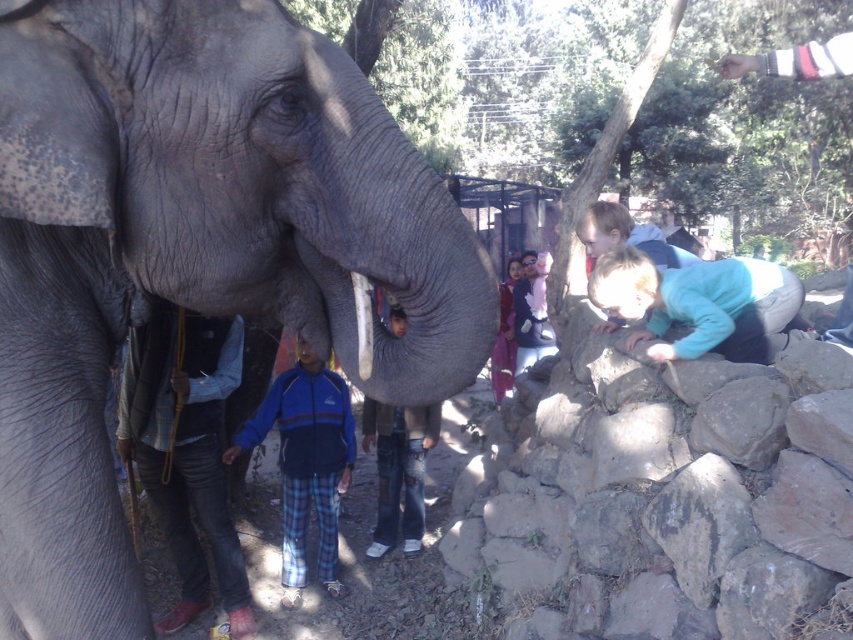
Measure the distance between light blue fleece at lower right and camera.

light blue fleece at lower right and camera are 2.97 meters apart from each other.

Locate an element on the screen. light blue fleece at lower right is located at coordinates (699, 304).

Image resolution: width=853 pixels, height=640 pixels. Identify the location of light blue fleece at lower right. (699, 304).

Is denim pants at left thinner than light blue fleece at lower right?

Yes, denim pants at left is thinner than light blue fleece at lower right.

Does denim pants at left have a lesser height compared to light blue fleece at lower right?

No.

Who is more distant from viewer, (175, 435) or (651, 355)?

Point (175, 435)

Locate an element on the screen. This screenshot has width=853, height=640. denim pants at left is located at coordinates (187, 452).

Who is positioned more to the left, blue fleece jacket at center or blue fleece jacket at lower left?

From the viewer's perspective, blue fleece jacket at center appears more on the left side.

Is point (270, 392) in front of point (369, 416)?

That is True.

The height and width of the screenshot is (640, 853). In order to click on blue fleece jacket at center in this screenshot , I will do `click(305, 461)`.